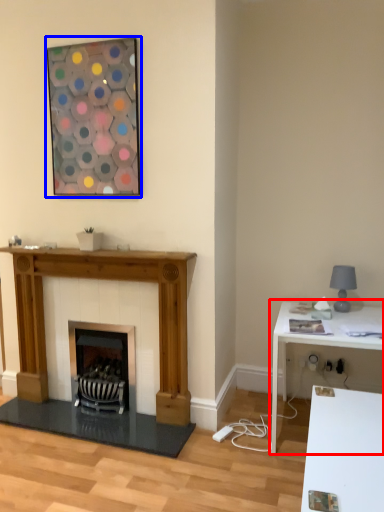
Question: Which object appears farthest to the camera in this image, table (highlighted by a red box) or picture frame (highlighted by a blue box)?

Choices:
 (A) table
 (B) picture frame

Answer: (B)